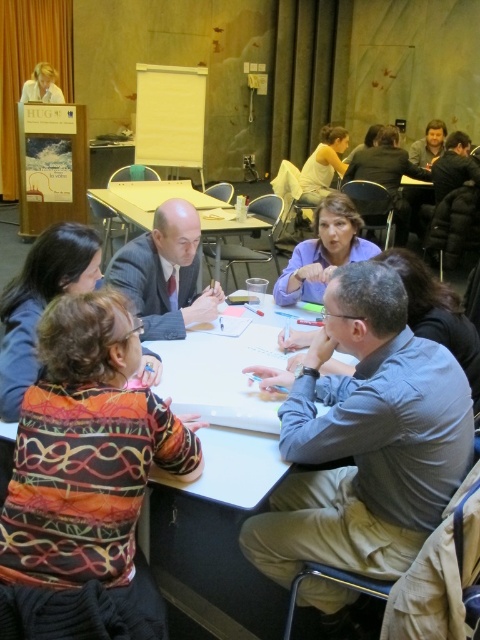
Is point (126, 372) behind point (23, 100)?

No, (126, 372) is in front of (23, 100).

Does knitted sweater at center appear under matte white shirt at upper left?

Correct, knitted sweater at center is located below matte white shirt at upper left.

This screenshot has height=640, width=480. Identify the location of knitted sweater at center. (85, 481).

Image resolution: width=480 pixels, height=640 pixels. Identify the location of knitted sweater at center. (85, 481).

From the picture: Between matte black suit at center and white plastic table at center, which one is positioned higher?

white plastic table at center is higher up.

Which of these two, matte black suit at center or white plastic table at center, stands taller?

white plastic table at center

Locate an element on the screen. This screenshot has width=480, height=640. matte black suit at center is located at coordinates (166, 273).

How far apart are white plastic table at center and matte white shirt at upper left?

white plastic table at center and matte white shirt at upper left are 3.52 meters apart.

Consider the image. Who is more forward, (118,198) or (52,88)?

Point (118,198) is more forward.

Who is more forward, [109,198] or [50,72]?

Point [109,198] is more forward.

This screenshot has width=480, height=640. I want to click on white plastic table at center, so click(228, 230).